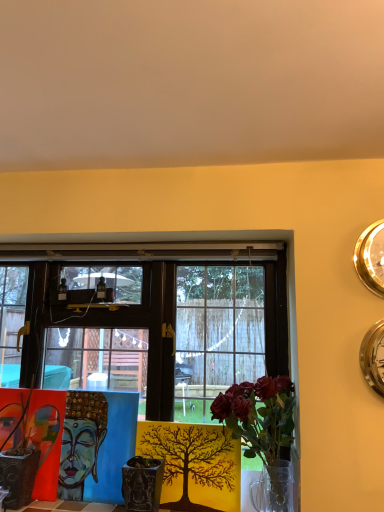
Identify the location of gold metallic clock at upper right, which is the second clock in bottom-to-top order. (371, 257).

Image resolution: width=384 pixels, height=512 pixels. What do you see at coordinates (114, 448) in the screenshot?
I see `wooden table at center` at bounding box center [114, 448].

From the picture: In order to face textured ceramic pot at center, should I rotate leftwards or rightwards?

A 6.705 degree turn to the left will do.

In order to click on silver metallic clock at upper right, the second clock positioned from the top in this screenshot , I will do `click(373, 357)`.

Which of these two, translucent glass vase at center or silver metallic clock at upper right, which is the first clock in bottom-to-top order, is bigger?

translucent glass vase at center is bigger.

What's the angular difference between translucent glass vase at center and silver metallic clock at upper right, which is the first clock in bottom-to-top order,'s facing directions?

There is a 0.00924-degree angle between the facing directions of translucent glass vase at center and silver metallic clock at upper right, which is the first clock in bottom-to-top order.

Considering the relative sizes of translucent glass vase at center and silver metallic clock at upper right, the second clock positioned from the top, in the image provided, is translucent glass vase at center wider than silver metallic clock at upper right, the second clock positioned from the top,?

Correct, the width of translucent glass vase at center exceeds that of silver metallic clock at upper right, the second clock positioned from the top.

Consider the image. Is the position of translucent glass vase at center more distant than that of silver metallic clock at upper right, the second clock positioned from the top?

No, the depth of translucent glass vase at center is less than that of silver metallic clock at upper right, the second clock positioned from the top.

In terms of size, does silver metallic clock at upper right, the second clock positioned from the top, appear bigger or smaller than textured ceramic pot at center?

Clearly, silver metallic clock at upper right, the second clock positioned from the top, is smaller in size than textured ceramic pot at center.

Can you confirm if silver metallic clock at upper right, the second clock positioned from the top, is positioned to the right of textured ceramic pot at center?

Correct, you'll find silver metallic clock at upper right, the second clock positioned from the top, to the right of textured ceramic pot at center.

Considering the positions of objects silver metallic clock at upper right, which is the first clock in bottom-to-top order, and textured ceramic pot at center in the image provided, who is behind, silver metallic clock at upper right, which is the first clock in bottom-to-top order, or textured ceramic pot at center?

textured ceramic pot at center is further from the camera.

Locate an element on the screen. This screenshot has height=512, width=384. flowerpot below the silver metallic clock at upper right, which is the first clock in bottom-to-top order (from the image's perspective) is located at coordinates (142, 483).

Considering the sizes of gold metallic clock at upper right, placed as the first clock when sorted from top to bottom, and translucent glass vase at center in the image, is gold metallic clock at upper right, placed as the first clock when sorted from top to bottom, wider or thinner than translucent glass vase at center?

In the image, gold metallic clock at upper right, placed as the first clock when sorted from top to bottom, appears to be more narrow than translucent glass vase at center.

Based on the photo, is gold metallic clock at upper right, placed as the first clock when sorted from top to bottom, at the right side of translucent glass vase at center?

Indeed, gold metallic clock at upper right, placed as the first clock when sorted from top to bottom, is positioned on the right side of translucent glass vase at center.

Is point (363, 248) closer or farther from the camera than point (285, 423)?

Point (363, 248) is positioned closer to the camera compared to point (285, 423).

Is gold metallic clock at upper right, placed as the first clock when sorted from top to bottom, next to translucent glass vase at center?

No, gold metallic clock at upper right, placed as the first clock when sorted from top to bottom, is not touching translucent glass vase at center.

Which of these two, textured ceramic pot at center or translucent glass vase at center, stands shorter?

textured ceramic pot at center.

Between textured ceramic pot at center and translucent glass vase at center, which one has smaller size?

textured ceramic pot at center.

Is textured ceramic pot at center positioned with its back to translucent glass vase at center?

No, textured ceramic pot at center is not facing away from translucent glass vase at center.

Can you tell me how much wooden table at center and textured ceramic pot at center differ in facing direction?

1.22 degrees.

Which of these two, wooden table at center or textured ceramic pot at center, is thinner?

Result: wooden table at center is thinner.

From the image's perspective, is wooden table at center located beneath textured ceramic pot at center?

No, from the image's perspective, wooden table at center is not below textured ceramic pot at center.

Which object is more forward, wooden table at center or textured ceramic pot at center?

textured ceramic pot at center is more forward.

Are translucent glass vase at center and textured ceramic pot at center beside each other?

No, translucent glass vase at center is not making contact with textured ceramic pot at center.

Is point (217, 494) closer to camera compared to point (157, 471)?

No, (217, 494) is further to viewer.

Considering the sizes of objects translucent glass vase at center and textured ceramic pot at center in the image provided, who is wider, translucent glass vase at center or textured ceramic pot at center?

textured ceramic pot at center is wider.

Consider the image. How distant is translucent glass vase at center from textured ceramic pot at center?

5.39 inches.

Considering the sizes of objects wooden table at center and gold metallic clock at upper right, placed as the first clock when sorted from top to bottom, in the image provided, who is taller, wooden table at center or gold metallic clock at upper right, placed as the first clock when sorted from top to bottom,?

wooden table at center.

From a real-world perspective, is wooden table at center above or below gold metallic clock at upper right, placed as the first clock when sorted from top to bottom?

wooden table at center is below gold metallic clock at upper right, placed as the first clock when sorted from top to bottom.

Is point (115, 455) closer or farther from the camera than point (383, 227)?

Clearly, point (115, 455) is more distant from the camera than point (383, 227).

Do you think wooden table at center is within gold metallic clock at upper right, which is the second clock in bottom-to-top order, or outside of it?

wooden table at center is not inside gold metallic clock at upper right, which is the second clock in bottom-to-top order, it's outside.

This screenshot has height=512, width=384. Identify the location of houseplant on the left of silver metallic clock at upper right, the second clock positioned from the top. (259, 415).

Where is `flowerpot directly beneath the silver metallic clock at upper right, which is the first clock in bottom-to-top order (from a real-world perspective)`? The height and width of the screenshot is (512, 384). flowerpot directly beneath the silver metallic clock at upper right, which is the first clock in bottom-to-top order (from a real-world perspective) is located at coordinates (142, 483).

When comparing their distances from textured ceramic pot at center, does silver metallic clock at upper right, which is the first clock in bottom-to-top order, or translucent glass vase at center seem closer?

translucent glass vase at center.

Which object lies nearer to the anchor point textured ceramic pot at center, wooden table at center or translucent glass vase at center?

wooden table at center is closer to textured ceramic pot at center.

Which object lies nearer to the anchor point wooden table at center, translucent glass vase at center or gold metallic clock at upper right, placed as the first clock when sorted from top to bottom?

translucent glass vase at center lies closer to wooden table at center than the other object.

Based on their spatial positions, is translucent glass vase at center or gold metallic clock at upper right, placed as the first clock when sorted from top to bottom, closer to translucent glass vase at center?

Among the two, translucent glass vase at center is located nearer to translucent glass vase at center.

Looking at the image, which one is located closer to silver metallic clock at upper right, which is the first clock in bottom-to-top order, translucent glass vase at center or wooden table at center?

Based on the image, translucent glass vase at center appears to be nearer to silver metallic clock at upper right, which is the first clock in bottom-to-top order.

Considering their positions, is gold metallic clock at upper right, which is the second clock in bottom-to-top order, positioned further to wooden table at center than translucent glass vase at center?

gold metallic clock at upper right, which is the second clock in bottom-to-top order, is further to wooden table at center.

Looking at the image, which one is located closer to gold metallic clock at upper right, which is the second clock in bottom-to-top order, translucent glass vase at center or silver metallic clock at upper right, the second clock positioned from the top?

Based on the image, silver metallic clock at upper right, the second clock positioned from the top, appears to be nearer to gold metallic clock at upper right, which is the second clock in bottom-to-top order.

Which object lies further to the anchor point wooden table at center, gold metallic clock at upper right, which is the second clock in bottom-to-top order, or silver metallic clock at upper right, the second clock positioned from the top?

gold metallic clock at upper right, which is the second clock in bottom-to-top order.

This screenshot has height=512, width=384. Find the location of `houseplant between gold metallic clock at upper right, which is the second clock in bottom-to-top order, and translucent glass vase at center from top to bottom`. houseplant between gold metallic clock at upper right, which is the second clock in bottom-to-top order, and translucent glass vase at center from top to bottom is located at coordinates (259, 415).

The width and height of the screenshot is (384, 512). I want to click on floral arrangement between wooden table at center and gold metallic clock at upper right, which is the second clock in bottom-to-top order, from left to right, so click(194, 464).

The image size is (384, 512). What are the coordinates of `floral arrangement between wooden table at center and translucent glass vase at center from left to right` in the screenshot? It's located at (194, 464).

At what (x,y) coordinates should I click in order to perform the action: click on houseplant between wooden table at center and gold metallic clock at upper right, which is the second clock in bottom-to-top order, from left to right. Please return your answer as a coordinate pair (x, y). Looking at the image, I should click on (259, 415).